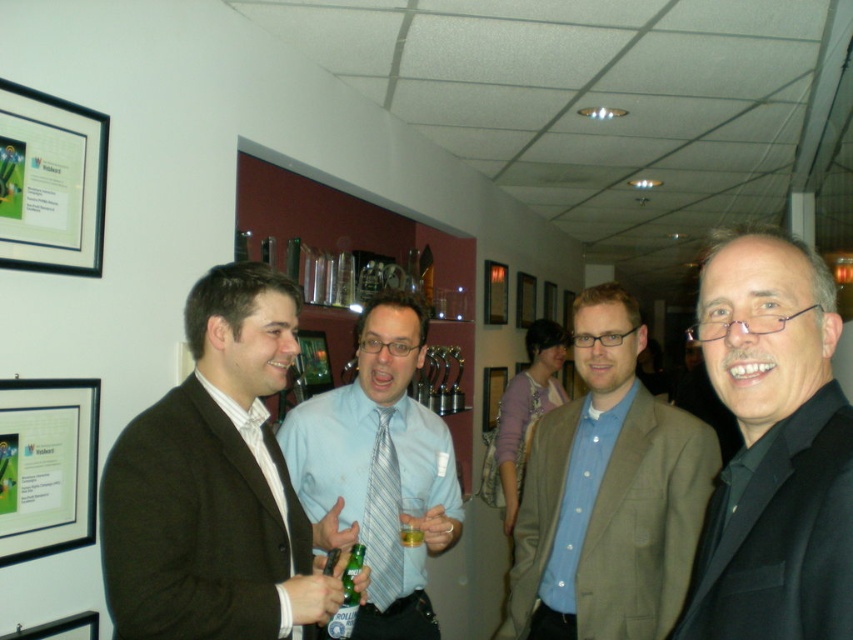
Question: Considering the relative positions of striped fabric tie at center and green glass bottle at center in the image provided, where is striped fabric tie at center located with respect to green glass bottle at center?

Choices:
 (A) left
 (B) right

Answer: (B)

Question: Which object is the farthest from the light brown suit at center?

Choices:
 (A) striped fabric tie at center
 (B) metallic silver picture frame at center
 (C) brushed metal picture frame at lower left

Answer: (B)

Question: Which of the following is the farthest from the observer?

Choices:
 (A) light brown suit at center
 (B) matte black frame at upper left
 (C) striped fabric tie at center

Answer: (C)

Question: Is brown wool suit at center positioned behind translucent glass beer at center?

Choices:
 (A) no
 (B) yes

Answer: (A)

Question: Does light blue striped tie at center appear over matte black frame at upper left?

Choices:
 (A) no
 (B) yes

Answer: (A)

Question: Among these objects, which one is nearest to the camera?

Choices:
 (A) brushed metal picture frame at lower left
 (B) light brown suit at center

Answer: (B)